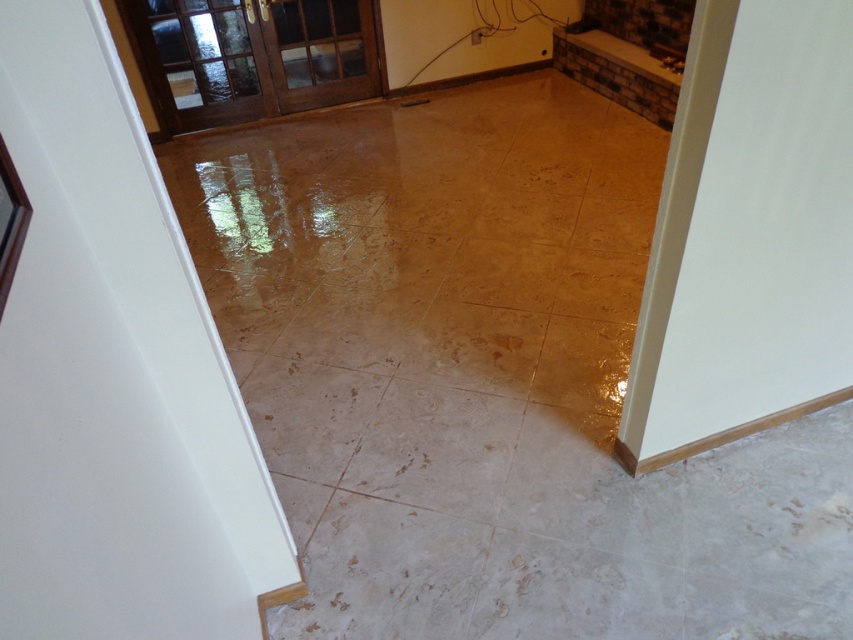
From the picture: You are standing at the doorway and see the white marble tile at center and the shiny gold tile at lower right. Which tile is wider?

The white marble tile at center might be wider than the shiny gold tile at lower right.